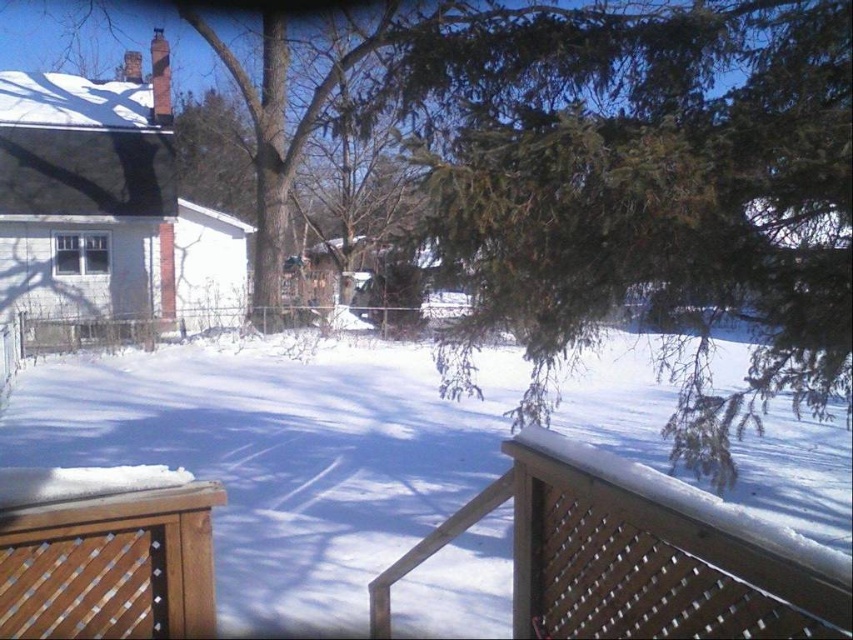
Can you confirm if green needle-like at upper right is positioned below wooden deck at center?

Incorrect, green needle-like at upper right is not positioned below wooden deck at center.

Measure the distance between point (x=534, y=209) and camera.

They are 4.22 meters apart.

Is point (492, 301) farther from viewer compared to point (780, 557)?

Yes, point (492, 301) is farther from viewer.

In order to click on green needle-like at upper right in this screenshot , I will do `click(643, 184)`.

Is green needle-like at upper right to the right of brown wooden deck at lower left from the viewer's perspective?

Correct, you'll find green needle-like at upper right to the right of brown wooden deck at lower left.

Based on the photo, is green needle-like at upper right taller than brown wooden deck at lower left?

Yes, green needle-like at upper right is taller than brown wooden deck at lower left.

What do you see at coordinates (643, 184) in the screenshot? I see `green needle-like at upper right` at bounding box center [643, 184].

Locate an element on the screen. The image size is (853, 640). green needle-like at upper right is located at coordinates (643, 184).

Does wooden deck at center lie behind brown wooden deck at lower left?

No, wooden deck at center is closer to the viewer.

Is wooden deck at center taller than brown wooden deck at lower left?

Indeed, wooden deck at center has a greater height compared to brown wooden deck at lower left.

Between point (749, 588) and point (35, 586), which one is positioned behind?

The point (35, 586) is behind.

Locate an element on the screen. wooden deck at center is located at coordinates (636, 554).